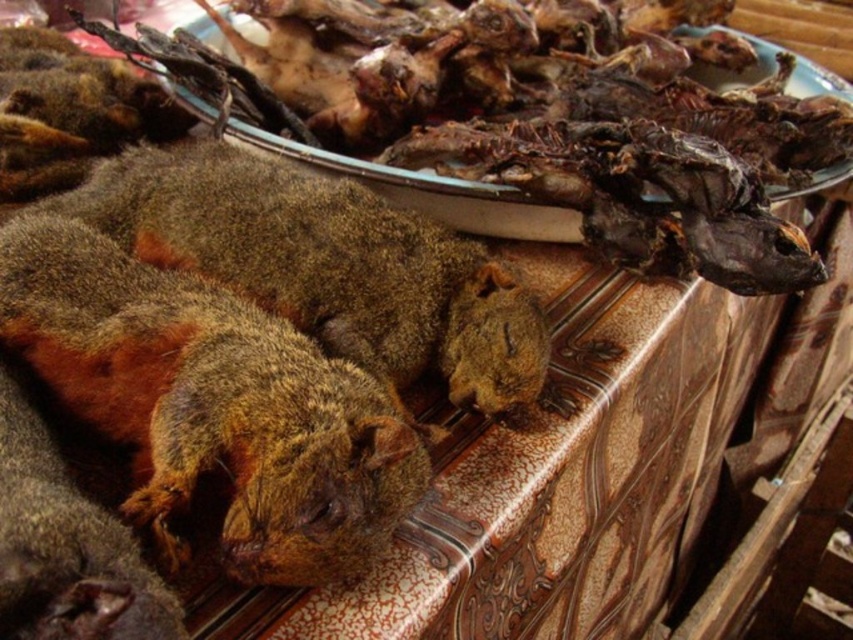
You are a small toy car that is 4 inches long. You want to move from the brown fuzzy squirrel at lower left to the brown fuzzy squirrel at center. Can you drive straight between them without hitting either?

The distance between the brown fuzzy squirrel at lower left and brown fuzzy squirrel at center is 6.13 inches. Since the toy car is 4 inches long, it can fit in the space between them as the distance is greater than the car length.

You are an animal rescuer who needs to approach both the brown fuzzy squirrel at lower left and the brown fuzzy squirrel at center. Which squirrel should you approach first to reach the one further away without backtracking?

You should first approach the brown fuzzy squirrel at center because the brown fuzzy squirrel at lower left is closer to you, so reaching the one at center would require moving past the closer one, but since the question asks to reach the further one without backtracking, you need to go to the center one first as it is further away.

You are a chef preparing a meal and see the brown fuzzy squirrel at lower left and the brown fuzzy squirrel at center on a marble countertop. Which squirrel is positioned closer to the edge of the countertop?

The brown fuzzy squirrel at lower left is closer to the edge of the countertop because it is located below the brown fuzzy squirrel at center.